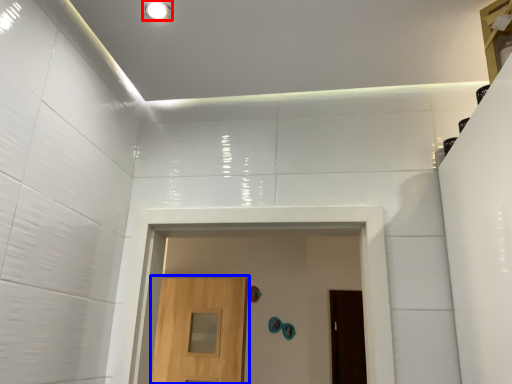
Question: Which point is closer to the camera, lighting (highlighted by a red box) or door (highlighted by a blue box)?

Choices:
 (A) lighting
 (B) door

Answer: (A)